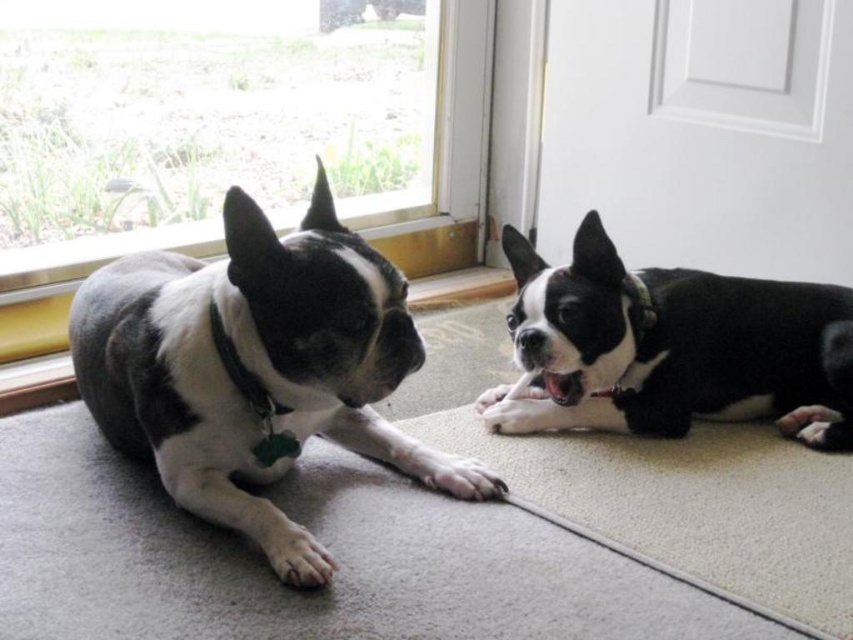
Is black and white fur at left above black matte dog at right?

Yes, black and white fur at left is above black matte dog at right.

Does black and white fur at left lie in front of black matte dog at right?

Yes, it is.

What are the coordinates of `black and white fur at left` in the screenshot? It's located at (254, 369).

Between black and white fur at left and white glossy door at upper right, which one is positioned higher?

Positioned higher is white glossy door at upper right.

You are a GUI agent. You are given a task and a screenshot of the screen. Output one action in this format:
    pyautogui.click(x=<x>, y=<y>)
    Task: Click on the black and white fur at left
    Image resolution: width=853 pixels, height=640 pixels.
    Given the screenshot: What is the action you would take?
    pyautogui.click(x=254, y=369)

At what (x,y) coordinates should I click in order to perform the action: click on black and white fur at left. Please return your answer as a coordinate pair (x, y). Looking at the image, I should click on (254, 369).

At what (x,y) coordinates should I click in order to perform the action: click on black and white fur at left. Please return your answer as a coordinate pair (x, y). The image size is (853, 640). Looking at the image, I should click on (254, 369).

Who is shorter, white glossy door at upper right or black matte dog at right?

black matte dog at right is shorter.

Is point (810, 17) behind point (543, 353)?

Yes, point (810, 17) is farther from viewer.

Where is `white glossy door at upper right`? The height and width of the screenshot is (640, 853). white glossy door at upper right is located at coordinates click(701, 132).